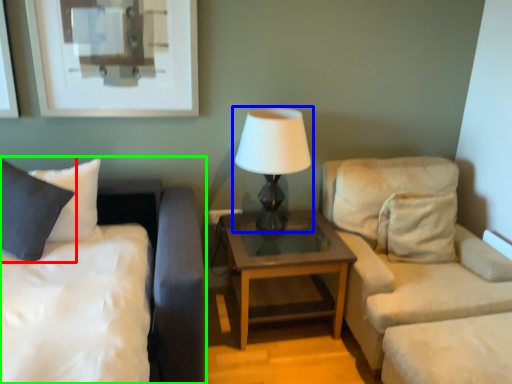
Question: Which is farther away from pillow (highlighted by a red box)? lamp (highlighted by a blue box) or bed (highlighted by a green box)?

Choices:
 (A) lamp
 (B) bed

Answer: (A)